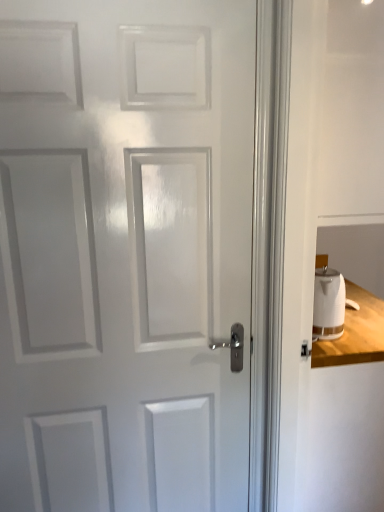
Question: From a real-world perspective, does white glossy door at center sit lower than white glossy electric kettle at right?

Choices:
 (A) no
 (B) yes

Answer: (A)

Question: Is white glossy door at center positioned with its back to white glossy electric kettle at right?

Choices:
 (A) no
 (B) yes

Answer: (A)

Question: Is white glossy door at center at the right side of white glossy electric kettle at right?

Choices:
 (A) no
 (B) yes

Answer: (A)

Question: Is white glossy door at center behind white glossy electric kettle at right?

Choices:
 (A) yes
 (B) no

Answer: (B)

Question: Is white glossy door at center facing towards white glossy electric kettle at right?

Choices:
 (A) no
 (B) yes

Answer: (A)

Question: Does white glossy door at center have a greater width compared to white glossy electric kettle at right?

Choices:
 (A) no
 (B) yes

Answer: (A)

Question: Is the position of white glossy electric kettle at right less distant than that of white glossy door at center?

Choices:
 (A) yes
 (B) no

Answer: (B)

Question: From a real-world perspective, is white glossy electric kettle at right located higher than white glossy door at center?

Choices:
 (A) no
 (B) yes

Answer: (A)

Question: From a real-world perspective, does white glossy electric kettle at right sit lower than white glossy door at center?

Choices:
 (A) no
 (B) yes

Answer: (B)

Question: Could you tell me if white glossy electric kettle at right is turned towards white glossy door at center?

Choices:
 (A) yes
 (B) no

Answer: (B)

Question: Does white glossy electric kettle at right have a larger size compared to white glossy door at center?

Choices:
 (A) no
 (B) yes

Answer: (A)

Question: Would you say white glossy electric kettle at right contains white glossy door at center?

Choices:
 (A) yes
 (B) no

Answer: (B)

Question: In the image, is white glossy door at center on the left side or the right side of white glossy electric kettle at right?

Choices:
 (A) right
 (B) left

Answer: (B)